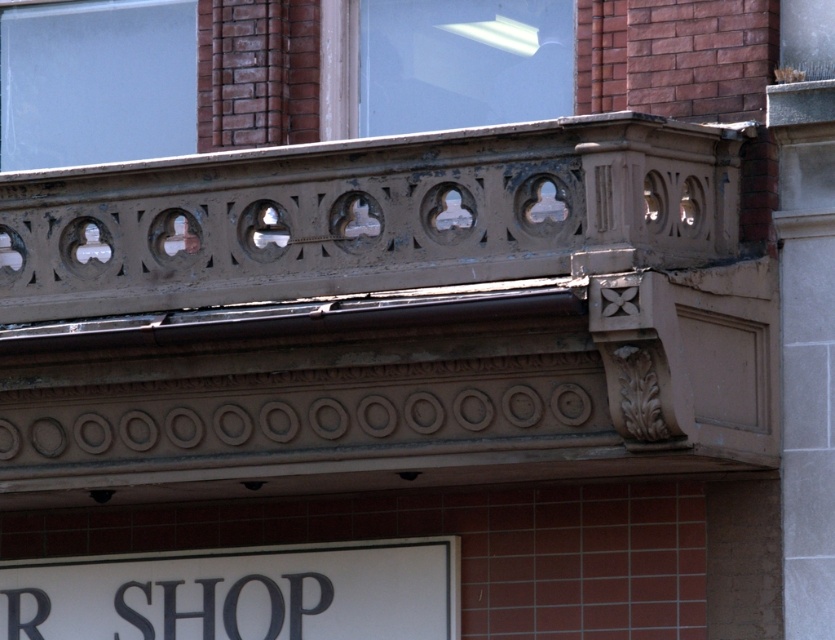
You are standing at the base of the building shown in the image. You want to take a photo of the matte brown balcony at upper center using a camera with a maximum zoom range of 50 feet. Will you be able to capture the entire balcony in your photo without moving closer?

The matte brown balcony at upper center is 53.56 feet from the camera, which exceeds the camera maximum zoom range of 50 feet. Therefore, you will not be able to capture the entire balcony in your photo without moving closer.

You are standing in front of the building and want to look through the transparent glass window at upper left. Where should you look relative to the shop sign?

The transparent glass window at upper left is located at point (95,81), which is to the upper left of the shop sign. So you should look towards the upper left direction relative to the shop sign to see the window.

In the scene shown: You are a delivery person trying to find the entrance to the shop. You see a white matte sign at lower center and a transparent glass window at upper center. Which object is positioned to the left side of the other?

The white matte sign at lower center is to the left of transparent glass window at upper center.